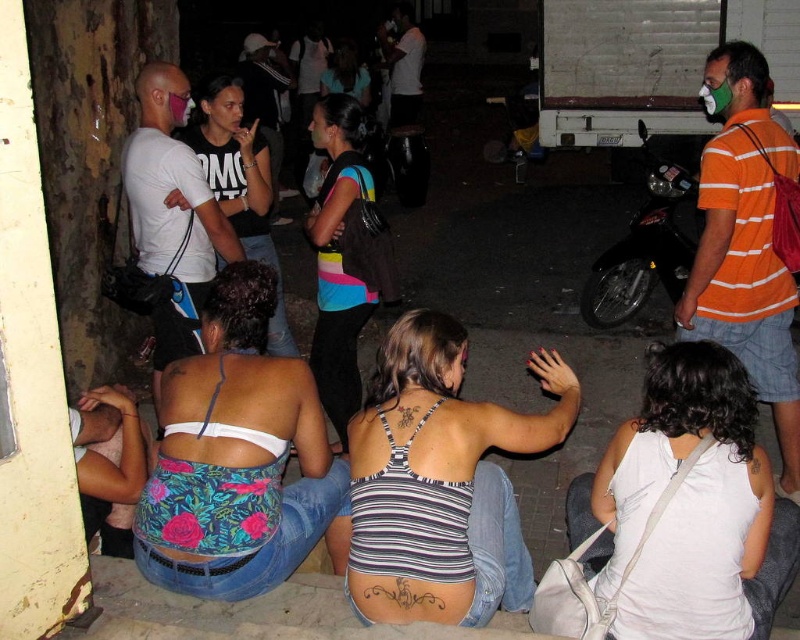
In the scene shown: Does striped fabric top at center appear on the right side of matte black tank top at upper left?

Correct, you'll find striped fabric top at center to the right of matte black tank top at upper left.

Which of these two, striped fabric top at center or matte black tank top at upper left, stands shorter?

Standing shorter between the two is matte black tank top at upper left.

Is point (352, 413) positioned before point (228, 100)?

Yes, it is.

Where is `striped fabric top at center`? striped fabric top at center is located at coordinates (342, 257).

Which is below, striped fabric tank top at center or white fabric tank top at lower right?

striped fabric tank top at center is lower down.

The image size is (800, 640). What do you see at coordinates (441, 481) in the screenshot?
I see `striped fabric tank top at center` at bounding box center [441, 481].

The image size is (800, 640). In order to click on striped fabric tank top at center in this screenshot , I will do `click(441, 481)`.

Is striped fabric tank top at center wider than striped fabric top at center?

Correct, the width of striped fabric tank top at center exceeds that of striped fabric top at center.

Can you confirm if striped fabric tank top at center is positioned to the right of striped fabric top at center?

Indeed, striped fabric tank top at center is positioned on the right side of striped fabric top at center.

Find the location of a particular element. The height and width of the screenshot is (640, 800). striped fabric tank top at center is located at coordinates click(x=441, y=481).